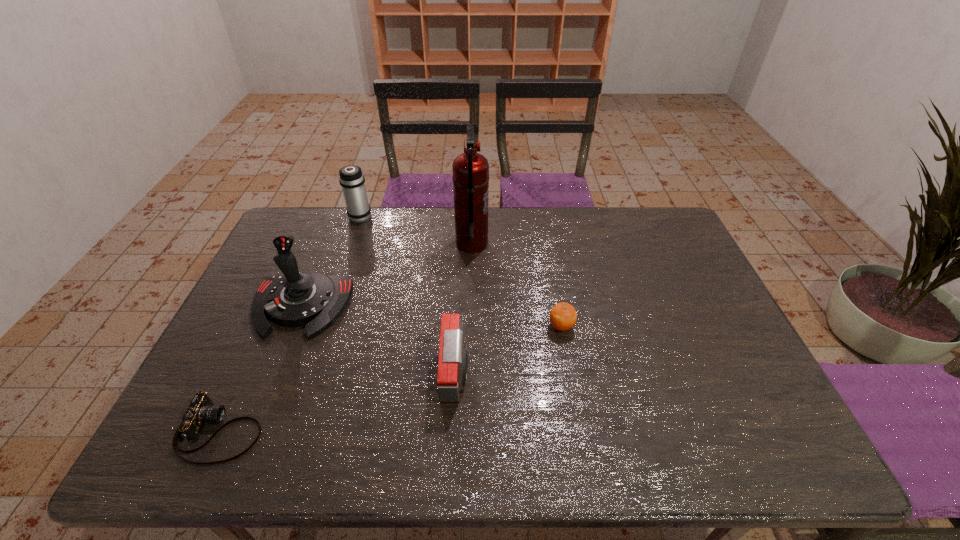
The height and width of the screenshot is (540, 960). I want to click on object present at the near left corner, so click(201, 410).

Where is `vacant space at the far edge of the desktop`? Image resolution: width=960 pixels, height=540 pixels. vacant space at the far edge of the desktop is located at coordinates (415, 246).

The width and height of the screenshot is (960, 540). In the image, there is a desktop. In order to click on vacant region at the near edge in this screenshot , I will do `click(307, 436)`.

Locate an element on the screen. The image size is (960, 540). vacant region at the right edge is located at coordinates (668, 294).

At what (x,y) coordinates should I click in order to perform the action: click on free space between the farthest object and the right camera. Please return your answer as a coordinate pair (x, y). The image size is (960, 540). Looking at the image, I should click on (408, 295).

Locate an element on the screen. The width and height of the screenshot is (960, 540). free space that is in between the thermos bottle and the rightmost object is located at coordinates (461, 271).

Find the location of a particular element. The height and width of the screenshot is (540, 960). unoccupied area between the tallest object and the farthest object is located at coordinates (417, 230).

Find the location of a particular element. vacant point located between the thermos bottle and the right camera is located at coordinates (408, 295).

You are a GUI agent. You are given a task and a screenshot of the screen. Output one action in this format:
    pyautogui.click(x=<x>, y=<y>)
    Task: Click on the free space between the joystick and the orange
    
    Given the screenshot: What is the action you would take?
    pyautogui.click(x=431, y=316)

The image size is (960, 540). In order to click on blank region between the taller camera and the fire extinguisher in this screenshot , I will do `click(464, 309)`.